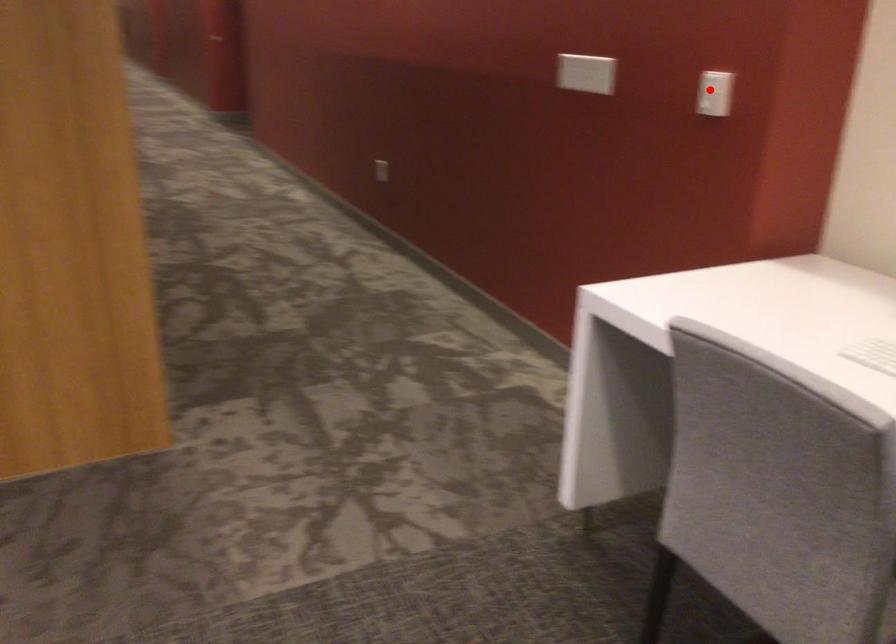
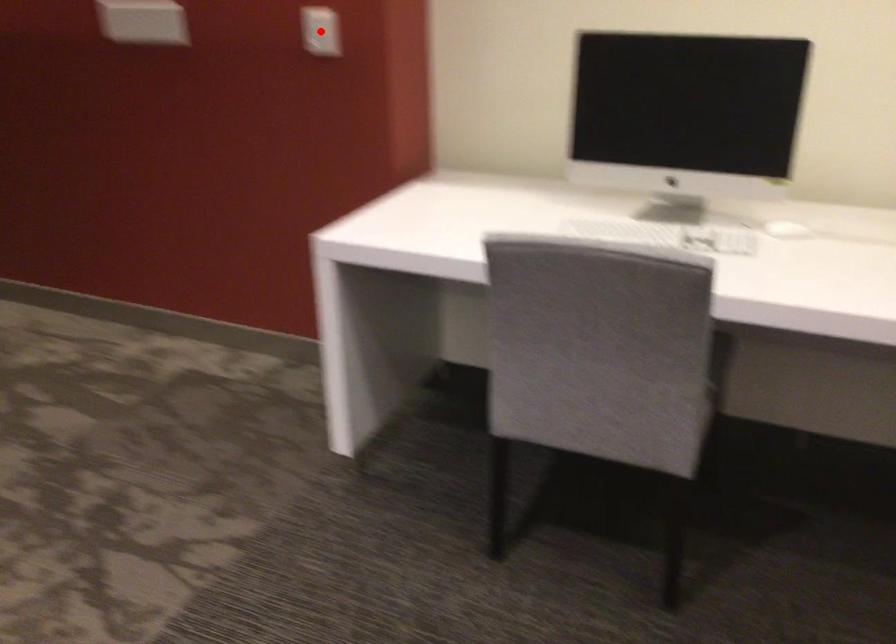
I am providing you with two images of the same scene from different viewpoints. A red point is marked on the first image and another point is marked on the second image. Is the red point in image1 aligned with the point shown in image2?

Yes